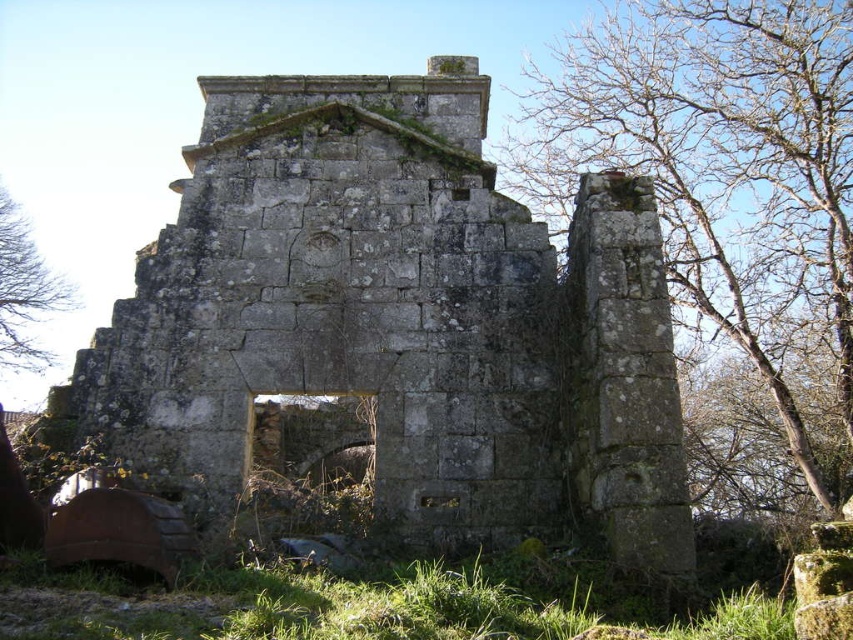
You are an archaeologist examining the ruins. You notice the green mossy stone wall at upper center and the brown wood tree at left. Which object is wider in this scene?

The green mossy stone wall at upper center might be wider than brown wood tree at left according to the description.

You are an archaeologist examining the ruins. You notice the gray stone ruins at center and the green mossy stone wall at upper center. Which of these two structures is located higher up in the image?

The green mossy stone wall at upper center is higher up because it is positioned above the gray stone ruins at center.

You are standing in front of the old stone structure and notice a specific point marked at coordinates (724, 180). Based on the scene description, can you determine what surface this point is located on?

The point is located on the green mossy stone wall at upper center.